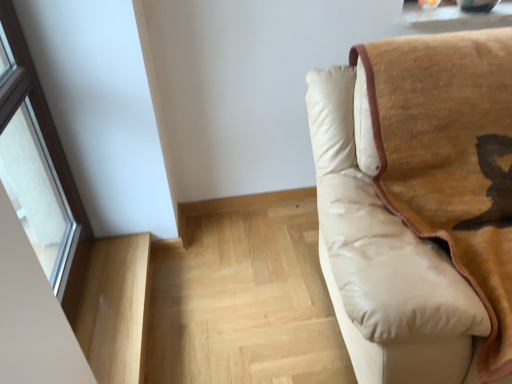
Question: From a real-world perspective, does light wood stairwell at lower left, the 2th stairwell viewed from the right, sit lower than beige leather couch at right?

Choices:
 (A) no
 (B) yes

Answer: (B)

Question: Can you confirm if light wood stairwell at lower left, acting as the first stairwell starting from the left, is positioned to the right of beige leather couch at right?

Choices:
 (A) yes
 (B) no

Answer: (B)

Question: Is light wood stairwell at lower left, acting as the first stairwell starting from the left, thinner than beige leather couch at right?

Choices:
 (A) yes
 (B) no

Answer: (A)

Question: Can you see light wood stairwell at lower left, the 2th stairwell viewed from the right, touching beige leather couch at right?

Choices:
 (A) yes
 (B) no

Answer: (B)

Question: Considering the relative sizes of light wood stairwell at lower left, acting as the first stairwell starting from the left, and beige leather couch at right in the image provided, is light wood stairwell at lower left, acting as the first stairwell starting from the left, shorter than beige leather couch at right?

Choices:
 (A) yes
 (B) no

Answer: (A)

Question: Is beige leather couch at right wider or thinner than transparent glass window at left?

Choices:
 (A) thin
 (B) wide

Answer: (B)

Question: Is beige leather couch at right taller or shorter than transparent glass window at left?

Choices:
 (A) tall
 (B) short

Answer: (A)

Question: Based on their sizes in the image, would you say beige leather couch at right is bigger or smaller than transparent glass window at left?

Choices:
 (A) small
 (B) big

Answer: (B)

Question: From the image's perspective, is beige leather couch at right positioned above or below transparent glass window at left?

Choices:
 (A) above
 (B) below

Answer: (B)

Question: Considering the positions of light wood stairwell at lower left, acting as the first stairwell starting from the left, and light wood stairwell at lower left, which ranks as the 2th stairwell in left-to-right order, in the image, is light wood stairwell at lower left, acting as the first stairwell starting from the left, bigger or smaller than light wood stairwell at lower left, which ranks as the 2th stairwell in left-to-right order,?

Choices:
 (A) small
 (B) big

Answer: (A)

Question: From their relative heights in the image, would you say light wood stairwell at lower left, acting as the first stairwell starting from the left, is taller or shorter than light wood stairwell at lower left, which ranks as the 2th stairwell in left-to-right order?

Choices:
 (A) tall
 (B) short

Answer: (A)

Question: Considering their positions, is light wood stairwell at lower left, the 2th stairwell viewed from the right, located in front of or behind light wood stairwell at lower left, the 1th stairwell positioned from the right?

Choices:
 (A) behind
 (B) front

Answer: (B)

Question: Looking at their shapes, would you say light wood stairwell at lower left, the 2th stairwell viewed from the right, is wider or thinner than light wood stairwell at lower left, which ranks as the 2th stairwell in left-to-right order?

Choices:
 (A) thin
 (B) wide

Answer: (A)

Question: Based on their sizes in the image, would you say beige leather couch at right is bigger or smaller than light wood stairwell at lower left, which ranks as the 2th stairwell in left-to-right order?

Choices:
 (A) big
 (B) small

Answer: (A)

Question: From the image's perspective, is beige leather couch at right positioned above or below light wood stairwell at lower left, which ranks as the 2th stairwell in left-to-right order?

Choices:
 (A) below
 (B) above

Answer: (B)